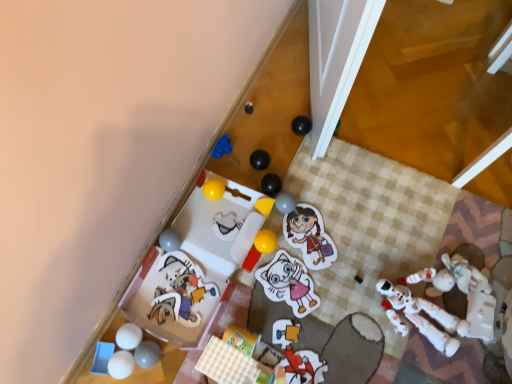
Where is `spots to the right of yellow matte block at upper center, which is the fifth toy in right-to-left order`? spots to the right of yellow matte block at upper center, which is the fifth toy in right-to-left order is located at coordinates (317, 216).